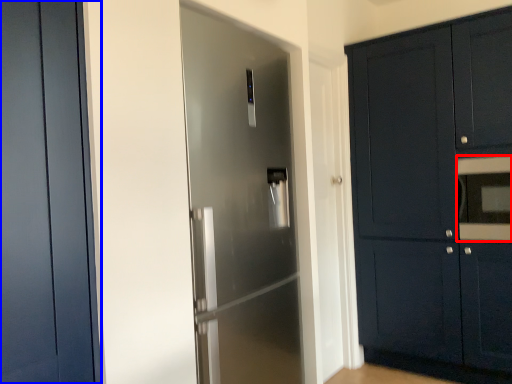
Question: Which point is further to the camera, oven (highlighted by a red box) or door (highlighted by a blue box)?

Choices:
 (A) oven
 (B) door

Answer: (A)